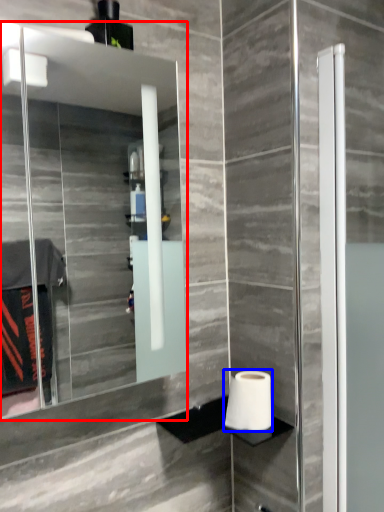
Question: Which of the following is the farthest to the observer, mirror (highlighted by a red box) or toilet paper (highlighted by a blue box)?

Choices:
 (A) mirror
 (B) toilet paper

Answer: (B)